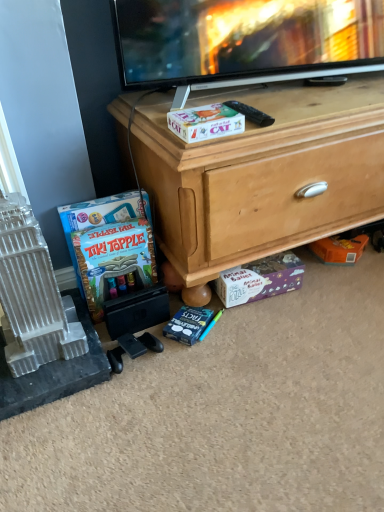
The height and width of the screenshot is (512, 384). I want to click on free space to the right of purple cardboard puzzle box at lower center, so click(318, 295).